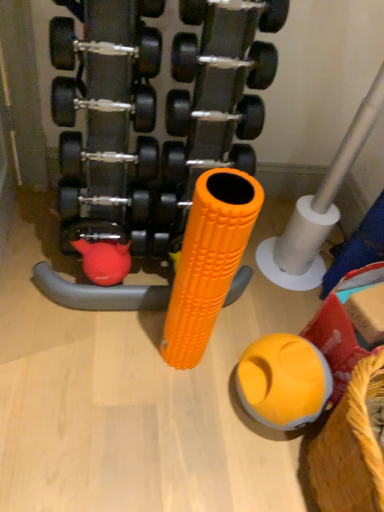
Question: Does rubberized yellow ball at lower right turn towards silver metallic pipe at center right?

Choices:
 (A) yes
 (B) no

Answer: (B)

Question: From a real-world perspective, is rubberized yellow ball at lower right physically above silver metallic pipe at center right?

Choices:
 (A) yes
 (B) no

Answer: (B)

Question: Is silver metallic pipe at center right surrounded by rubberized yellow ball at lower right?

Choices:
 (A) no
 (B) yes

Answer: (A)

Question: Can you confirm if rubberized yellow ball at lower right is positioned to the right of silver metallic pipe at center right?

Choices:
 (A) no
 (B) yes

Answer: (A)

Question: Is rubberized yellow ball at lower right wider than silver metallic pipe at center right?

Choices:
 (A) no
 (B) yes

Answer: (A)

Question: Is rubberized yellow ball at lower right positioned with its back to silver metallic pipe at center right?

Choices:
 (A) no
 (B) yes

Answer: (A)

Question: Can we say black rubber dumbbell at center lies outside rubberized yellow ball at lower right?

Choices:
 (A) yes
 (B) no

Answer: (A)

Question: Is black rubber dumbbell at center not near rubberized yellow ball at lower right?

Choices:
 (A) yes
 (B) no

Answer: (B)

Question: Does black rubber dumbbell at center turn towards rubberized yellow ball at lower right?

Choices:
 (A) yes
 (B) no

Answer: (A)

Question: From a real-world perspective, is black rubber dumbbell at center physically above rubberized yellow ball at lower right?

Choices:
 (A) yes
 (B) no

Answer: (A)

Question: Can you confirm if black rubber dumbbell at center is bigger than rubberized yellow ball at lower right?

Choices:
 (A) no
 (B) yes

Answer: (B)

Question: From the image's perspective, is black rubber dumbbell at center beneath rubberized yellow ball at lower right?

Choices:
 (A) no
 (B) yes

Answer: (A)

Question: Is yellow woven basket at lower right at the left side of black rubber dumbbell at center?

Choices:
 (A) no
 (B) yes

Answer: (A)